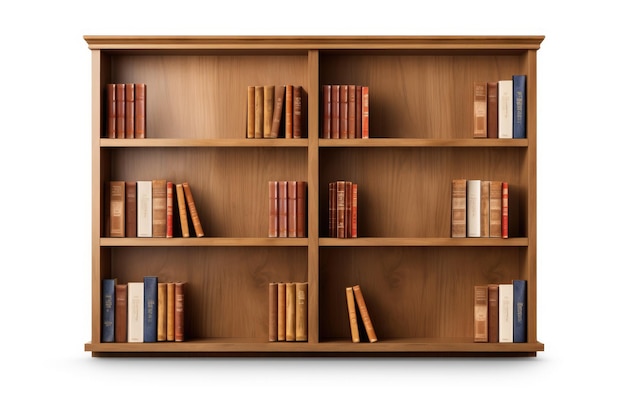
Find the location of a particular element. The width and height of the screenshot is (626, 393). books on bottom right shelf is located at coordinates (355, 323), (369, 328), (483, 320), (494, 312), (508, 309), (520, 326).